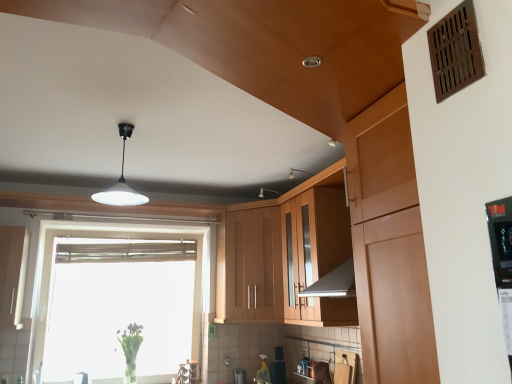
What do you see at coordinates (316, 247) in the screenshot? This screenshot has height=384, width=512. I see `wooden cabinet at center, placed as the first cabinetry when sorted from right to left` at bounding box center [316, 247].

I want to click on translucent glass vase at lower left, so click(x=130, y=349).

In order to face white glossy pendant light at center, should I rotate leftwards or rightwards?

Turn left by 17.176 degrees to look at white glossy pendant light at center.

In order to click on white glossy pendant light at center in this screenshot , I will do `click(121, 181)`.

The image size is (512, 384). Find the location of `wooden cabinet at center, the second cabinetry in the left-to-right sequence`. wooden cabinet at center, the second cabinetry in the left-to-right sequence is located at coordinates (249, 267).

Where is `matte black spray bottle at lower center`? The width and height of the screenshot is (512, 384). matte black spray bottle at lower center is located at coordinates (278, 367).

This screenshot has height=384, width=512. Find the location of `wooden cabinet at center, placed as the first cabinetry when sorted from right to left`. wooden cabinet at center, placed as the first cabinetry when sorted from right to left is located at coordinates (316, 247).

From a real-world perspective, which object rests below the other?

From a 3D spatial view, wooden cabinet at center, the 3th cabinetry viewed from the left, is below.

Can you confirm if wooden cabinet at center, the 3th cabinetry viewed from the left, is positioned to the right of white glossy pendant light at center?

Yes, wooden cabinet at center, the 3th cabinetry viewed from the left, is to the right of white glossy pendant light at center.

Which is correct: wooden cabinet at center, the 3th cabinetry viewed from the left, is inside white glossy pendant light at center, or outside of it?

wooden cabinet at center, the 3th cabinetry viewed from the left, is not inside white glossy pendant light at center, it's outside.

Which of these two, wooden cabinet at center, the 3th cabinetry viewed from the left, or white glossy pendant light at center, stands taller?

Standing taller between the two is wooden cabinet at center, the 3th cabinetry viewed from the left.

Find the location of a particular element. window on the left of the wooden cabinet at center, placed as the first cabinetry when sorted from right to left is located at coordinates (119, 303).

Are wooden cabinet at center, placed as the first cabinetry when sorted from right to left, and transparent glass window at center beside each other?

wooden cabinet at center, placed as the first cabinetry when sorted from right to left, and transparent glass window at center are clearly separated.

Is wooden cabinet at center, the 3th cabinetry viewed from the left, surrounding transparent glass window at center?

No.

From a real-world perspective, which object stands above the other?

wooden cabinet at center, placed as the first cabinetry when sorted from right to left.

Is white glossy cabinet at left, which is counted as the 1th cabinetry, starting from the left, inside translucent glass vase at lower left?

No.

Between translucent glass vase at lower left and white glossy cabinet at left, which is counted as the 1th cabinetry, starting from the left, which one has larger size?

white glossy cabinet at left, which is counted as the 1th cabinetry, starting from the left, is bigger.

From a real-world perspective, who is located lower, translucent glass vase at lower left or white glossy cabinet at left, positioned as the 3th cabinetry in right-to-left order?

translucent glass vase at lower left, from a real-world perspective.

How much distance is there between translucent glass vase at lower left and white glossy cabinet at left, which is counted as the 1th cabinetry, starting from the left?

translucent glass vase at lower left and white glossy cabinet at left, which is counted as the 1th cabinetry, starting from the left, are 3.31 feet apart.

Is wooden cabinet at center, the 3th cabinetry viewed from the left, directly adjacent to translucent glass vase at lower left?

No, wooden cabinet at center, the 3th cabinetry viewed from the left, is not making contact with translucent glass vase at lower left.

Is translucent glass vase at lower left inside wooden cabinet at center, placed as the first cabinetry when sorted from right to left?

No, wooden cabinet at center, placed as the first cabinetry when sorted from right to left, does not contain translucent glass vase at lower left.

The image size is (512, 384). In order to click on plant below the wooden cabinet at center, placed as the first cabinetry when sorted from right to left (from the image's perspective) in this screenshot , I will do `click(130, 349)`.

From a real-world perspective, is wooden cabinet at center, placed as the first cabinetry when sorted from right to left, positioned above or below translucent glass vase at lower left?

wooden cabinet at center, placed as the first cabinetry when sorted from right to left, is situated higher than translucent glass vase at lower left in the real world.

In terms of width, does matte black spray bottle at lower center look wider or thinner when compared to white glossy pendant light at center?

Considering their sizes, matte black spray bottle at lower center looks slimmer than white glossy pendant light at center.

Which of these two, matte black spray bottle at lower center or white glossy pendant light at center, is smaller?

matte black spray bottle at lower center.

How many degrees apart are the facing directions of wooden cabinet at center, the 3th cabinetry viewed from the left, and wooden cabinet at center, which is the 2th cabinetry from right to left?

wooden cabinet at center, the 3th cabinetry viewed from the left, and wooden cabinet at center, which is the 2th cabinetry from right to left, are facing 38.2 degrees away from each other.

Does point (319, 227) appear closer or farther from the camera than point (249, 309)?

Point (319, 227).

Could you measure the distance between wooden cabinet at center, the 3th cabinetry viewed from the left, and wooden cabinet at center, the second cabinetry in the left-to-right sequence?

wooden cabinet at center, the 3th cabinetry viewed from the left, is 14.26 inches from wooden cabinet at center, the second cabinetry in the left-to-right sequence.

Does wooden cabinet at center, the 3th cabinetry viewed from the left, appear on the left side of wooden cabinet at center, the second cabinetry in the left-to-right sequence?

Incorrect, wooden cabinet at center, the 3th cabinetry viewed from the left, is not on the left side of wooden cabinet at center, the second cabinetry in the left-to-right sequence.

Based on their positions, is transparent glass window at center located to the left or right of white glossy pendant light at center?

transparent glass window at center is to the left of white glossy pendant light at center.

From a real-world perspective, is transparent glass window at center positioned over white glossy pendant light at center based on gravity?

No.

Is transparent glass window at center looking in the opposite direction of white glossy pendant light at center?

That's not correct — transparent glass window at center is not looking away from white glossy pendant light at center.

From the image's perspective, count 1st cabinetrys downward from the white glossy pendant light at center and point to it. Please provide its 2D coordinates.

[(316, 247)]

Identify the location of window that appears on the left of wooden cabinet at center, placed as the first cabinetry when sorted from right to left. This screenshot has height=384, width=512. (119, 303).

Which object lies further to the anchor point wooden cabinet at center, the second cabinetry in the left-to-right sequence, matte black spray bottle at lower center or white glossy cabinet at left, which is counted as the 1th cabinetry, starting from the left?

white glossy cabinet at left, which is counted as the 1th cabinetry, starting from the left.

Estimate the real-world distances between objects in this image. Which object is closer to translucent glass vase at lower left, white glossy pendant light at center or matte black spray bottle at lower center?

The object closer to translucent glass vase at lower left is matte black spray bottle at lower center.

When comparing their distances from white glossy cabinet at left, positioned as the 3th cabinetry in right-to-left order, does translucent glass vase at lower left or wooden cabinet at center, the 3th cabinetry viewed from the left, seem closer?

Based on the image, translucent glass vase at lower left appears to be nearer to white glossy cabinet at left, positioned as the 3th cabinetry in right-to-left order.

When comparing their distances from matte black spray bottle at lower center, does wooden cabinet at center, placed as the first cabinetry when sorted from right to left, or wooden cabinet at center, the second cabinetry in the left-to-right sequence, seem closer?

The object closer to matte black spray bottle at lower center is wooden cabinet at center, the second cabinetry in the left-to-right sequence.

Estimate the real-world distances between objects in this image. Which object is closer to white glossy cabinet at left, which is counted as the 1th cabinetry, starting from the left, white glossy pendant light at center or wooden cabinet at center, which is the 2th cabinetry from right to left?

Among the two, white glossy pendant light at center is located nearer to white glossy cabinet at left, which is counted as the 1th cabinetry, starting from the left.

When comparing their distances from wooden cabinet at center, which is the 2th cabinetry from right to left, does wooden cabinet at center, placed as the first cabinetry when sorted from right to left, or white glossy cabinet at left, which is counted as the 1th cabinetry, starting from the left, seem further?

white glossy cabinet at left, which is counted as the 1th cabinetry, starting from the left, is further to wooden cabinet at center, which is the 2th cabinetry from right to left.

When comparing their distances from matte black spray bottle at lower center, does translucent glass vase at lower left or wooden cabinet at center, placed as the first cabinetry when sorted from right to left, seem further?

wooden cabinet at center, placed as the first cabinetry when sorted from right to left, is positioned further to the anchor matte black spray bottle at lower center.

When comparing their distances from transparent glass window at center, does translucent glass vase at lower left or matte black spray bottle at lower center seem further?

matte black spray bottle at lower center lies further to transparent glass window at center than the other object.

At what (x,y) coordinates should I click in order to perform the action: click on window between white glossy cabinet at left, which is counted as the 1th cabinetry, starting from the left, and matte black spray bottle at lower center from left to right. Please return your answer as a coordinate pair (x, y). The height and width of the screenshot is (384, 512). Looking at the image, I should click on (119, 303).

You are a GUI agent. You are given a task and a screenshot of the screen. Output one action in this format:
    pyautogui.click(x=<x>, y=<y>)
    Task: Click on the light fixture between white glossy cabinet at left, which is counted as the 1th cabinetry, starting from the left, and wooden cabinet at center, the 3th cabinetry viewed from the left
    
    Given the screenshot: What is the action you would take?
    pyautogui.click(x=121, y=181)

Where is `window situated between white glossy cabinet at left, which is counted as the 1th cabinetry, starting from the left, and translucent glass vase at lower left from left to right`? This screenshot has width=512, height=384. window situated between white glossy cabinet at left, which is counted as the 1th cabinetry, starting from the left, and translucent glass vase at lower left from left to right is located at coordinates (119, 303).

The height and width of the screenshot is (384, 512). Identify the location of light fixture between transparent glass window at center and wooden cabinet at center, the 3th cabinetry viewed from the left, from left to right. (121, 181).